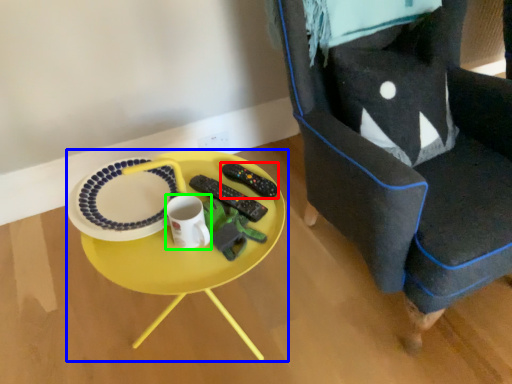
Question: Which object is positioned farthest from remote control (highlighted by a red box)? Select from table (highlighted by a blue box) and coffee cup (highlighted by a green box).

Choices:
 (A) table
 (B) coffee cup

Answer: (B)